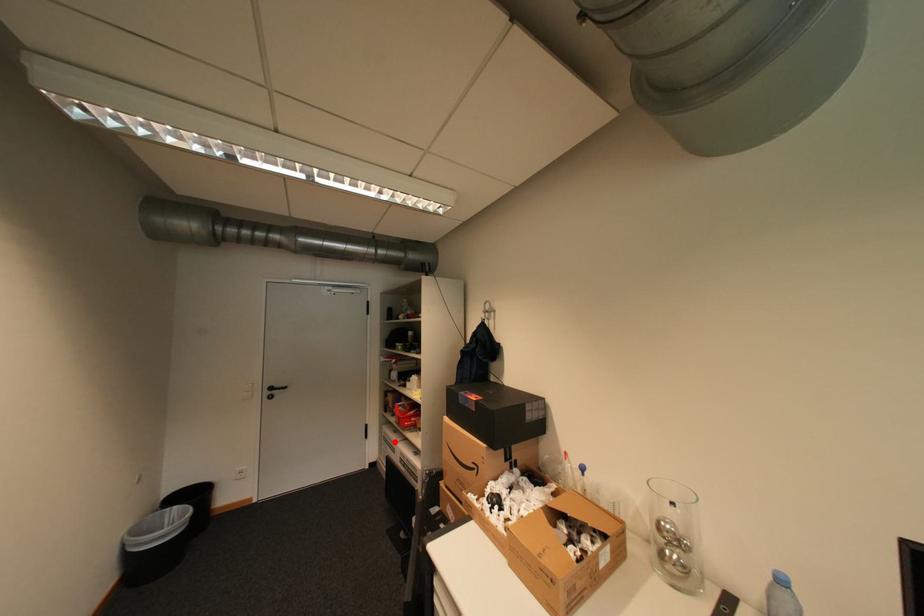
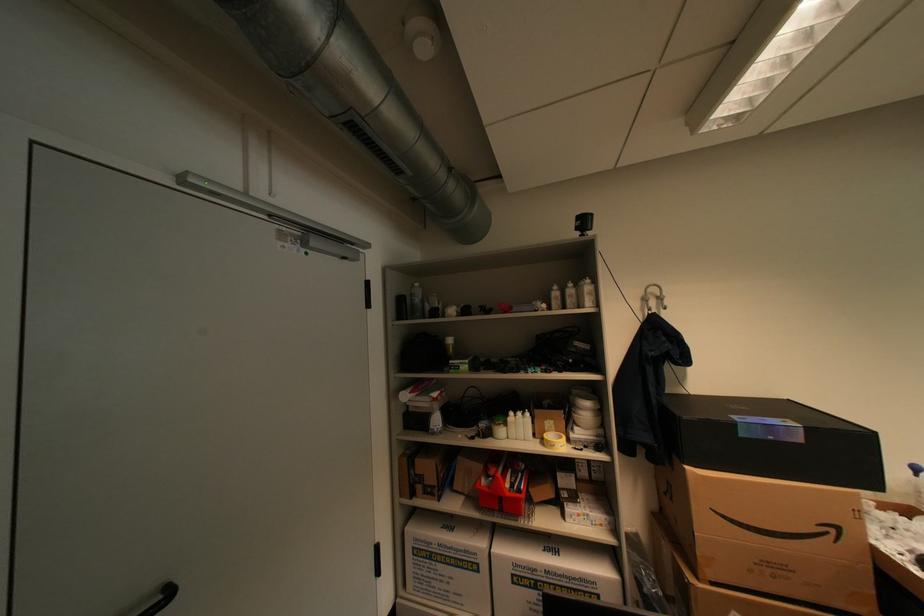
Question: I am providing you with two images of the same scene from different viewpoints. Image1 has a red point marked. In image2, the corresponding 3D location appears at what relative position? Reply with the corresponding letter.

Choices:
 (A) Closer
 (B) Farther

Answer: (A)